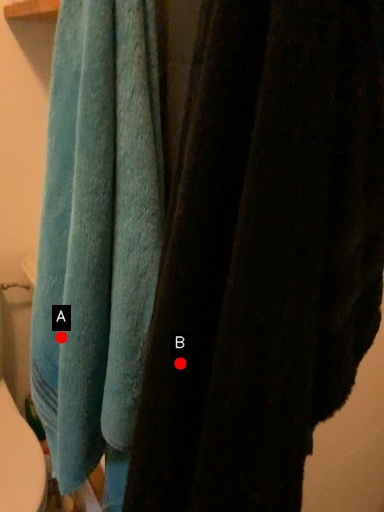
Question: Two points are circled on the image, labeled by A and B beside each circle. Which of the following is the farthest from the observer?

Choices:
 (A) A is further
 (B) B is further

Answer: (A)